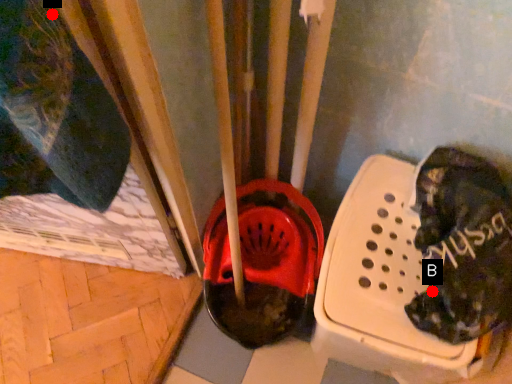
Question: Two points are circled on the image, labeled by A and B beside each circle. Which point is farther from the camera taking this photo?

Choices:
 (A) A is further
 (B) B is further

Answer: (B)